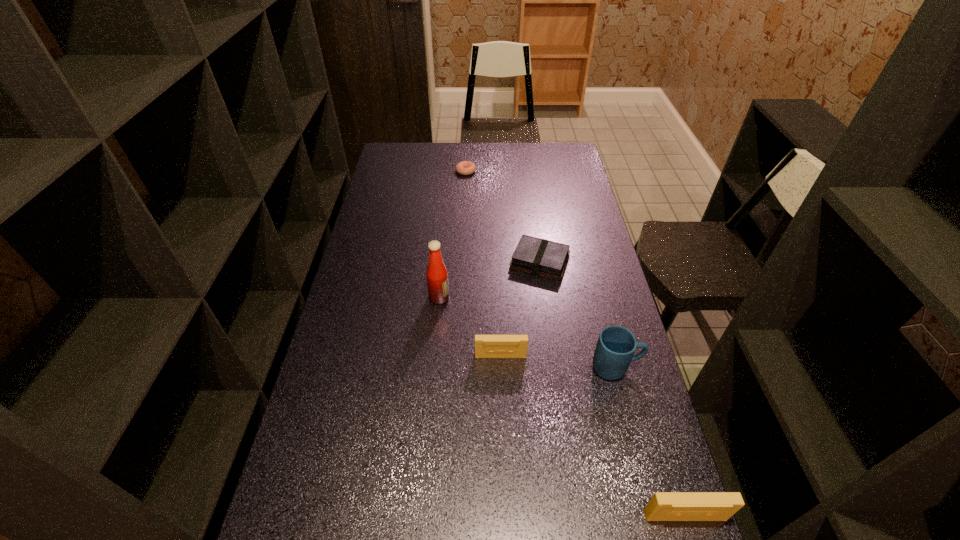
Find the location of a particular element. The height and width of the screenshot is (540, 960). the fifth shortest object is located at coordinates (616, 345).

At what (x,y) coordinates should I click in order to perform the action: click on free space located at the front of the shorter videotape with spools. Please return your answer as a coordinate pair (x, y). This screenshot has width=960, height=540. Looking at the image, I should click on (503, 417).

Locate an element on the screen. Image resolution: width=960 pixels, height=540 pixels. vacant area situated 0.220m on the left of the farthest object is located at coordinates (407, 171).

Find the location of a particular element. This screenshot has height=540, width=960. free space located 0.120m on the back of the book is located at coordinates (535, 224).

Find the location of `free region located on the front-facing side of the condiment`. free region located on the front-facing side of the condiment is located at coordinates (519, 298).

This screenshot has width=960, height=540. I want to click on object that is at the far edge, so click(x=465, y=167).

Where is `object positioned at the near edge`? object positioned at the near edge is located at coordinates pyautogui.click(x=664, y=506).

Identify the location of videotape positioned at the right edge. This screenshot has width=960, height=540. (664, 506).

You are a GUI agent. You are given a task and a screenshot of the screen. Output one action in this format:
    pyautogui.click(x=<x>, y=<y>)
    Task: Click on the book that is at the right edge
    The height and width of the screenshot is (540, 960).
    Given the screenshot: What is the action you would take?
    pyautogui.click(x=540, y=257)

At what (x,y) coordinates should I click in order to perform the action: click on mug located at the right edge. Please return your answer as a coordinate pair (x, y). Looking at the image, I should click on (616, 345).